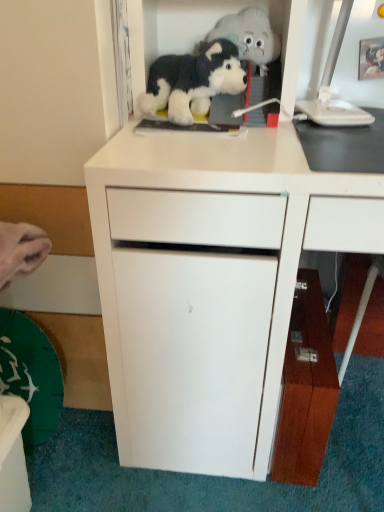
Locate an element on the screen. This screenshot has height=512, width=384. vacant space to the right of wooden cabinet at lower right, arranged as the 1th cabinetry when viewed from the right is located at coordinates (355, 413).